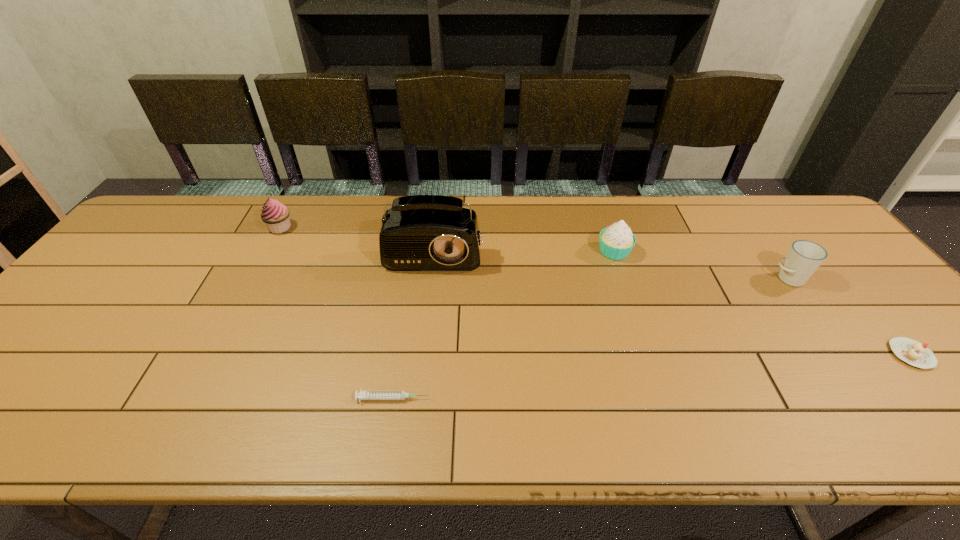
Locate an element on the screen. The image size is (960, 540). vacant space positioned on the front-facing side of the radio receiver is located at coordinates (428, 312).

Locate an element on the screen. vacant region located on the right of the farthest cupcake is located at coordinates (377, 228).

What are the coordinates of `free location located on the back of the second cupcake from left to right` in the screenshot? It's located at (603, 219).

Find the location of `vacant space located 0.060m with a handle on the side of the fifth object from left to right`. vacant space located 0.060m with a handle on the side of the fifth object from left to right is located at coordinates [x=749, y=279].

Find the location of a particular element. This screenshot has height=540, width=960. free spot located with a handle on the side of the fifth object from left to right is located at coordinates (658, 279).

Locate an element on the screen. This screenshot has height=540, width=960. free space located 0.350m with a handle on the side of the fifth object from left to right is located at coordinates [643, 279].

Locate an element on the screen. This screenshot has width=960, height=540. free region located on the back of the nearest cupcake is located at coordinates (833, 264).

Where is `blank area located 0.240m at the needle end of the nearest object`? This screenshot has height=540, width=960. blank area located 0.240m at the needle end of the nearest object is located at coordinates click(541, 399).

Find the location of `radio receiver that is at the far edge`. radio receiver that is at the far edge is located at coordinates (420, 232).

You are a GUI agent. You are given a task and a screenshot of the screen. Output one action in this format:
    pyautogui.click(x=<x>, y=<y>)
    Task: Click on the object situated at the right edge
    This screenshot has height=540, width=960.
    Given the screenshot: What is the action you would take?
    pyautogui.click(x=912, y=352)